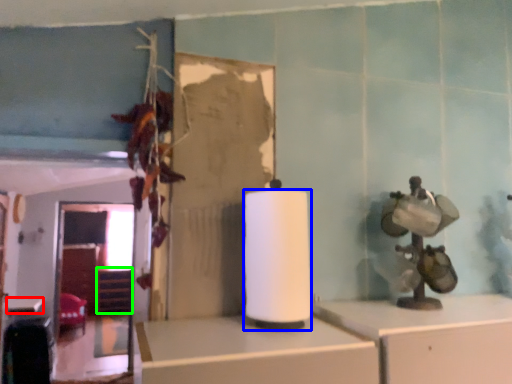
Question: Which object is the closest to the table (highlighted by a red box)? Choose among these: paper towel (highlighted by a blue box) or shelf (highlighted by a green box).

Choices:
 (A) paper towel
 (B) shelf

Answer: (B)